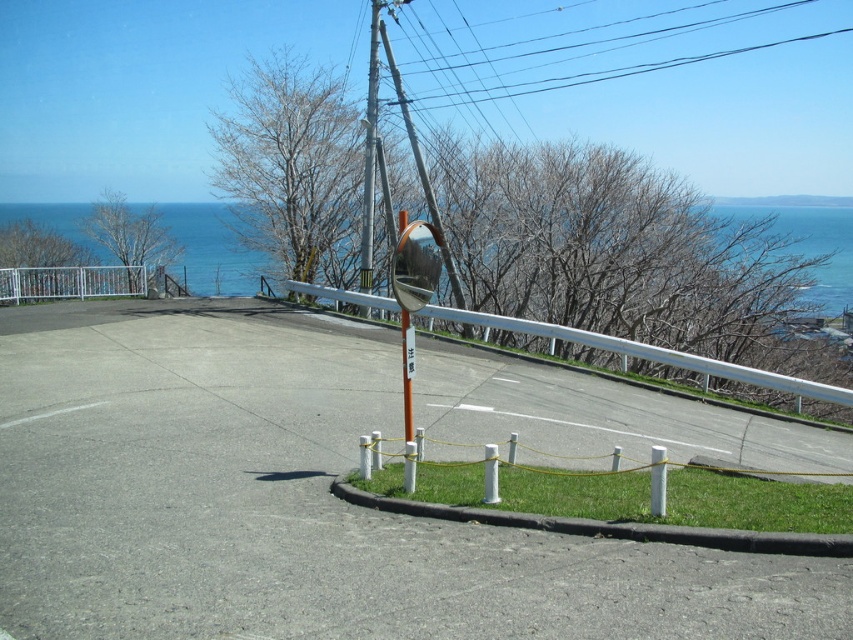
Question: From the image, what is the correct spatial relationship of black wire at upper center in relation to white metallic fence at upper left?

Choices:
 (A) above
 (B) below

Answer: (A)

Question: Which point appears farthest from the camera in this image?

Choices:
 (A) (178, 266)
 (B) (369, 74)
 (C) (775, 8)

Answer: (C)

Question: Does white metal guardrail at center appear over white metallic fence at upper left?

Choices:
 (A) yes
 (B) no

Answer: (B)

Question: Among these objects, which one is farthest from the camera?

Choices:
 (A) black wire at upper center
 (B) blue water at upper center
 (C) metallic pole at center
 (D) white metallic fence at upper left

Answer: (D)

Question: Among these points, which one is nearest to the camera?

Choices:
 (A) (265, 266)
 (B) (370, 35)
 (C) (636, 68)
 (D) (125, 288)

Answer: (D)

Question: Is black wire at upper center smaller than metallic gray pole at center?

Choices:
 (A) no
 (B) yes

Answer: (A)